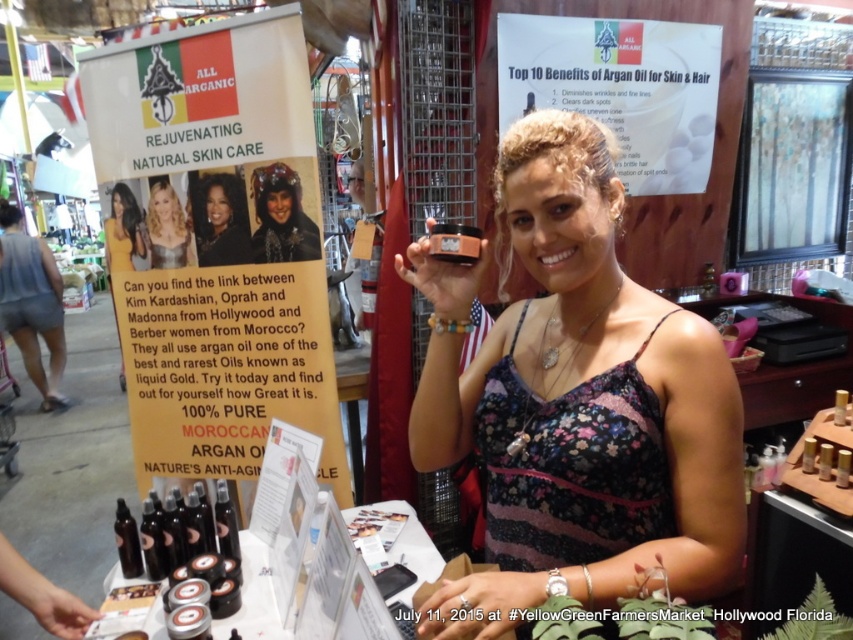
You are a photographer at the Yellow Green Farmers Market in Hollywood, Florida. You want to take a photo of the woman holding the argan oil container while ensuring the matte black helmet at center is visible in the background. Your camera has a maximum focus range of 2 meters. Can you capture both subjects clearly in one shot?

The matte black helmet at center and camera are 1.90 meters apart from each other, so yes, the photographer can capture both subjects clearly in one shot since the distance between them is within the camera maximum focus range of 2 meters.

You are a customer at the Yellow Green Farmers Market and notice two matte black items in the image. Which one is shorter in height between the matte black helmet at center and the matte black hair at upper left?

The matte black helmet at center is not as tall as the matte black hair at upper left, so the matte black helmet at center is shorter in height.